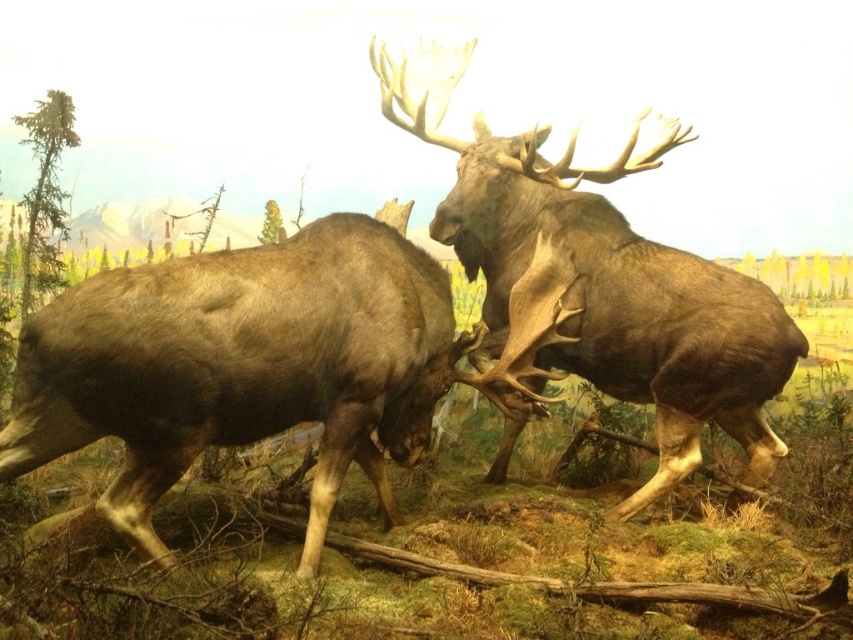
Question: Where is brown matte moose at center located in relation to brown velvet moose at center in the image?

Choices:
 (A) below
 (B) above

Answer: (A)

Question: Which point appears farthest from the camera in this image?

Choices:
 (A) (549, 330)
 (B) (374, 432)

Answer: (B)

Question: Is brown matte moose at center wider than brown velvet moose at center?

Choices:
 (A) yes
 (B) no

Answer: (B)

Question: Which of the following is the closest to the observer?

Choices:
 (A) (184, 323)
 (B) (531, 196)

Answer: (A)

Question: Observing the image, what is the correct spatial positioning of brown matte moose at center in reference to brown velvet moose at center?

Choices:
 (A) below
 (B) above

Answer: (A)